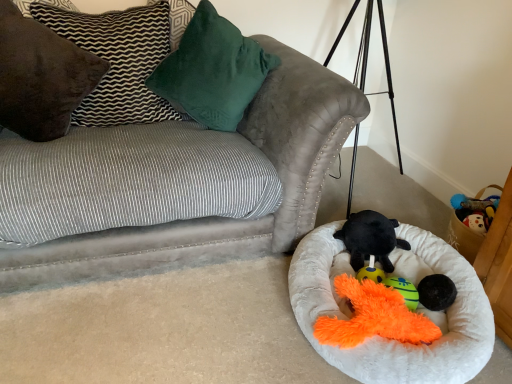
Find the location of `velvety green pillow at upper center, which ranks as the 1th pillow in right-to-left order`. velvety green pillow at upper center, which ranks as the 1th pillow in right-to-left order is located at coordinates (212, 71).

What do you see at coordinates (370, 238) in the screenshot?
I see `black plush toy at center, positioned as the second toy in front-to-back order` at bounding box center [370, 238].

Find the location of a particular element. This screenshot has width=512, height=384. black plush toy at center, positioned as the second toy in front-to-back order is located at coordinates (370, 238).

Find the location of a particular element. Image resolution: width=512 pixels, height=384 pixels. white fluffy dog bed at lower right is located at coordinates (418, 311).

The width and height of the screenshot is (512, 384). What do you see at coordinates (436, 292) in the screenshot?
I see `black fuzzy ball at lower right, which appears as the first toy when viewed from the front` at bounding box center [436, 292].

What do you see at coordinates (404, 290) in the screenshot? Image resolution: width=512 pixels, height=384 pixels. I see `teal plush toy at lower center` at bounding box center [404, 290].

Describe the element at coordinates (373, 317) in the screenshot. I see `orange plush toy at lower center` at that location.

At what (x,y) coordinates should I click in order to perform the action: click on velvety green pillow at upper center, acting as the 3th pillow starting from the left. Please return your answer as a coordinate pair (x, y). Image resolution: width=512 pixels, height=384 pixels. Looking at the image, I should click on (212, 71).

What's the angular difference between brown suede pillow at upper left, which appears as the second pillow when viewed from the right, and white fluffy dog bed at lower right's facing directions?

The angle between the facing direction of brown suede pillow at upper left, which appears as the second pillow when viewed from the right, and the facing direction of white fluffy dog bed at lower right is 28 degrees.

Which object is positioned more to the right, brown suede pillow at upper left, which is counted as the second pillow, starting from the left, or white fluffy dog bed at lower right?

Positioned to the right is white fluffy dog bed at lower right.

Is brown suede pillow at upper left, which is counted as the second pillow, starting from the left, facing away from white fluffy dog bed at lower right?

No, brown suede pillow at upper left, which is counted as the second pillow, starting from the left,'s orientation is not away from white fluffy dog bed at lower right.

Is brown suede pillow at upper left, which appears as the second pillow when viewed from the right, situated inside white fluffy dog bed at lower right or outside?

brown suede pillow at upper left, which appears as the second pillow when viewed from the right, lies outside white fluffy dog bed at lower right.

Does point (492, 346) come behind point (217, 87)?

That is False.

Image resolution: width=512 pixels, height=384 pixels. I want to click on the 2nd pillow behind when counting from the white fluffy dog bed at lower right, so click(212, 71).

From the picture: Is white fluffy dog bed at lower right looking in the opposite direction of velvety green pillow at upper center, acting as the 3th pillow starting from the left?

No, white fluffy dog bed at lower right is not facing the opposite direction of velvety green pillow at upper center, acting as the 3th pillow starting from the left.

Looking at this image, is white fluffy dog bed at lower right wider or thinner than velvety green pillow at upper center, acting as the 3th pillow starting from the left?

Considering their sizes, white fluffy dog bed at lower right looks broader than velvety green pillow at upper center, acting as the 3th pillow starting from the left.

From a real-world perspective, is brown suede pillow at upper left, which is counted as the second pillow, starting from the left, positioned over black fuzzy ball at lower right, which appears as the first toy when viewed from the front, based on gravity?

Yes, from a real-world perspective, brown suede pillow at upper left, which is counted as the second pillow, starting from the left, is on top of black fuzzy ball at lower right, which appears as the first toy when viewed from the front.

Considering the relative sizes of brown suede pillow at upper left, which is counted as the second pillow, starting from the left, and black fuzzy ball at lower right, which appears as the first toy when viewed from the front, in the image provided, is brown suede pillow at upper left, which is counted as the second pillow, starting from the left, wider than black fuzzy ball at lower right, which appears as the first toy when viewed from the front,?

Yes, brown suede pillow at upper left, which is counted as the second pillow, starting from the left, is wider than black fuzzy ball at lower right, which appears as the first toy when viewed from the front.

Would you say brown suede pillow at upper left, which is counted as the second pillow, starting from the left, is to the left or to the right of black fuzzy ball at lower right, which appears as the first toy when viewed from the front, in the picture?

Clearly, brown suede pillow at upper left, which is counted as the second pillow, starting from the left, is on the left of black fuzzy ball at lower right, which appears as the first toy when viewed from the front, in the image.

Between white fluffy dog bed at lower right and brown suede pillow at upper left, which is counted as the second pillow, starting from the left, which one appears on the left side from the viewer's perspective?

brown suede pillow at upper left, which is counted as the second pillow, starting from the left.

How much distance is there between white fluffy dog bed at lower right and brown suede pillow at upper left, which is counted as the second pillow, starting from the left?

A distance of 1.06 meters exists between white fluffy dog bed at lower right and brown suede pillow at upper left, which is counted as the second pillow, starting from the left.

Is white fluffy dog bed at lower right inside or outside of brown suede pillow at upper left, which appears as the second pillow when viewed from the right?

white fluffy dog bed at lower right cannot be found inside brown suede pillow at upper left, which appears as the second pillow when viewed from the right.

Is white fluffy dog bed at lower right beside brown suede pillow at upper left, which is counted as the second pillow, starting from the left?

white fluffy dog bed at lower right and brown suede pillow at upper left, which is counted as the second pillow, starting from the left, are clearly separated.

Can you see teal plush toy at lower center touching black plush toy at center, which ranks as the first toy in back-to-front order?

teal plush toy at lower center is not next to black plush toy at center, which ranks as the first toy in back-to-front order, and they're not touching.

In terms of size, does teal plush toy at lower center appear bigger or smaller than black plush toy at center, positioned as the second toy in front-to-back order?

Clearly, teal plush toy at lower center is smaller in size than black plush toy at center, positioned as the second toy in front-to-back order.

Does point (389, 280) appear closer or farther from the camera than point (402, 243)?

Point (389, 280).

Is the depth of teal plush toy at lower center greater than that of black plush toy at center, which ranks as the first toy in back-to-front order?

No, teal plush toy at lower center is closer to the camera.

Considering the relative sizes of brown suede pillow at upper left, which appears as the second pillow when viewed from the right, and orange plush toy at lower center in the image provided, is brown suede pillow at upper left, which appears as the second pillow when viewed from the right, bigger than orange plush toy at lower center?

Yes.

Is point (103, 126) closer or farther from the camera than point (380, 296)?

Point (103, 126) is positioned farther from the camera compared to point (380, 296).

From the image's perspective, which one is positioned lower, brown suede pillow at upper left, which is counted as the second pillow, starting from the left, or orange plush toy at lower center?

orange plush toy at lower center.

Between brown suede pillow at upper left, which is counted as the second pillow, starting from the left, and orange plush toy at lower center, which one has smaller width?

brown suede pillow at upper left, which is counted as the second pillow, starting from the left, is thinner.

From the image's perspective, between velvety green pillow at upper center, which ranks as the 1th pillow in right-to-left order, and brown velvet pillow at upper left, the third pillow viewed from the right, which one is located above?

velvety green pillow at upper center, which ranks as the 1th pillow in right-to-left order, appears higher in the image.

Is velvety green pillow at upper center, acting as the 3th pillow starting from the left, positioned far away from brown velvet pillow at upper left, the third pillow viewed from the right?

That's not correct — velvety green pillow at upper center, acting as the 3th pillow starting from the left, is a little close to brown velvet pillow at upper left, the third pillow viewed from the right.

Which of these two, velvety green pillow at upper center, acting as the 3th pillow starting from the left, or brown velvet pillow at upper left, acting as the 1th pillow starting from the left, is smaller?

brown velvet pillow at upper left, acting as the 1th pillow starting from the left, is smaller.

From a real-world perspective, is velvety green pillow at upper center, acting as the 3th pillow starting from the left, physically above brown velvet pillow at upper left, the third pillow viewed from the right?

Yes, from a real-world perspective, velvety green pillow at upper center, acting as the 3th pillow starting from the left, is on top of brown velvet pillow at upper left, the third pillow viewed from the right.

Locate an element on the screen. The image size is (512, 384). pillow that is the 3rd one when counting upward from the white fluffy dog bed at lower right (from the image's perspective) is located at coordinates (121, 58).

Locate an element on the screen. The height and width of the screenshot is (384, 512). pillow that is the 1st one when counting leftward from the white fluffy dog bed at lower right is located at coordinates (212, 71).

Considering their positions, is black fuzzy ball at lower right, arranged as the second toy when viewed from the back, positioned further to velvet gray couch at upper left than brown velvet pillow at upper left, the third pillow viewed from the right?

Among the two, black fuzzy ball at lower right, arranged as the second toy when viewed from the back, is located further to velvet gray couch at upper left.

When comparing their distances from velvety green pillow at upper center, which ranks as the 1th pillow in right-to-left order, does velvet gray couch at upper left or orange plush toy at lower center seem closer?

velvet gray couch at upper left is positioned closer to the anchor velvety green pillow at upper center, which ranks as the 1th pillow in right-to-left order.

Based on their spatial positions, is orange plush toy at lower center or black plush toy at center, which ranks as the first toy in back-to-front order, closer to white fluffy dog bed at lower right?

Among the two, orange plush toy at lower center is located nearer to white fluffy dog bed at lower right.

Looking at the image, which one is located closer to white fluffy dog bed at lower right, velvety green pillow at upper center, acting as the 3th pillow starting from the left, or orange plush toy at lower center?

orange plush toy at lower center lies closer to white fluffy dog bed at lower right than the other object.

From the image, which object appears to be nearer to brown velvet pillow at upper left, acting as the 1th pillow starting from the left, black fuzzy ball at lower right, which appears as the first toy when viewed from the front, or teal plush toy at lower center?

Based on the image, teal plush toy at lower center appears to be nearer to brown velvet pillow at upper left, acting as the 1th pillow starting from the left.

Based on their spatial positions, is teal plush toy at lower center or velvet gray couch at upper left further from black plush toy at center, which ranks as the first toy in back-to-front order?

The object further to black plush toy at center, which ranks as the first toy in back-to-front order, is velvet gray couch at upper left.

Considering their positions, is white fluffy dog bed at lower right positioned closer to black plush toy at center, positioned as the second toy in front-to-back order, than velvet gray couch at upper left?

Based on the image, white fluffy dog bed at lower right appears to be nearer to black plush toy at center, positioned as the second toy in front-to-back order.

Considering their positions, is black fuzzy ball at lower right, which appears as the first toy when viewed from the front, positioned further to teal plush toy at lower center than brown suede pillow at upper left, which is counted as the second pillow, starting from the left?

Among the two, brown suede pillow at upper left, which is counted as the second pillow, starting from the left, is located further to teal plush toy at lower center.

The height and width of the screenshot is (384, 512). What are the coordinates of `dog bed between velvety green pillow at upper center, which ranks as the 1th pillow in right-to-left order, and black fuzzy ball at lower right, which appears as the first toy when viewed from the front, in the vertical direction` in the screenshot? It's located at (418, 311).

At what (x,y) coordinates should I click in order to perform the action: click on miniature located between brown velvet pillow at upper left, acting as the 1th pillow starting from the left, and teal plush toy at lower center in the left-right direction. Please return your answer as a coordinate pair (x, y). Looking at the image, I should click on (373, 317).

Identify the location of toy between white fluffy dog bed at lower right and black plush toy at center, positioned as the second toy in front-to-back order, from front to back. (436, 292).

Find the location of a particular element. The image size is (512, 384). toy between white fluffy dog bed at lower right and teal plush toy at lower center in the front-back direction is located at coordinates (436, 292).